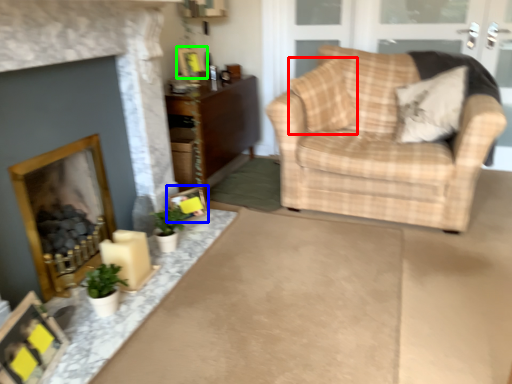
Question: Estimate the real-world distances between objects in this image. Which object is farther from pillow (highlighted by a red box), picture frame (highlighted by a blue box) or picture frame (highlighted by a green box)?

Choices:
 (A) picture frame
 (B) picture frame

Answer: (A)